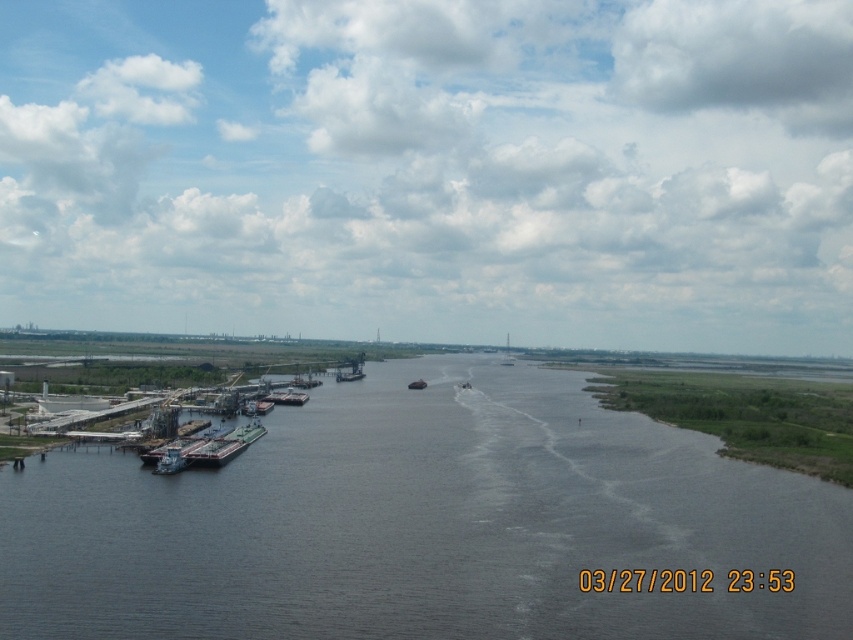
Question: Among these objects, which one is nearest to the camera?

Choices:
 (A) metallic gray boat at center
 (B) metallic gray barge at center-left
 (C) dark gray water at center

Answer: (C)

Question: Can you confirm if metallic gray barge at lower left is wider than metallic gray barge at center-left?

Choices:
 (A) no
 (B) yes

Answer: (A)

Question: Among these objects, which one is nearest to the camera?

Choices:
 (A) metallic gray boat at center
 (B) metallic gray barge at lower left
 (C) metallic gray barge at left
 (D) dark gray water at center

Answer: (D)

Question: Which point appears farthest from the camera in this image?

Choices:
 (A) (253, 426)
 (B) (169, 474)

Answer: (A)

Question: Does metallic gray barge at lower left have a greater width compared to metallic gray barge at center-left?

Choices:
 (A) no
 (B) yes

Answer: (A)

Question: Is dark gray water at center below metallic gray boat at center?

Choices:
 (A) yes
 (B) no

Answer: (A)